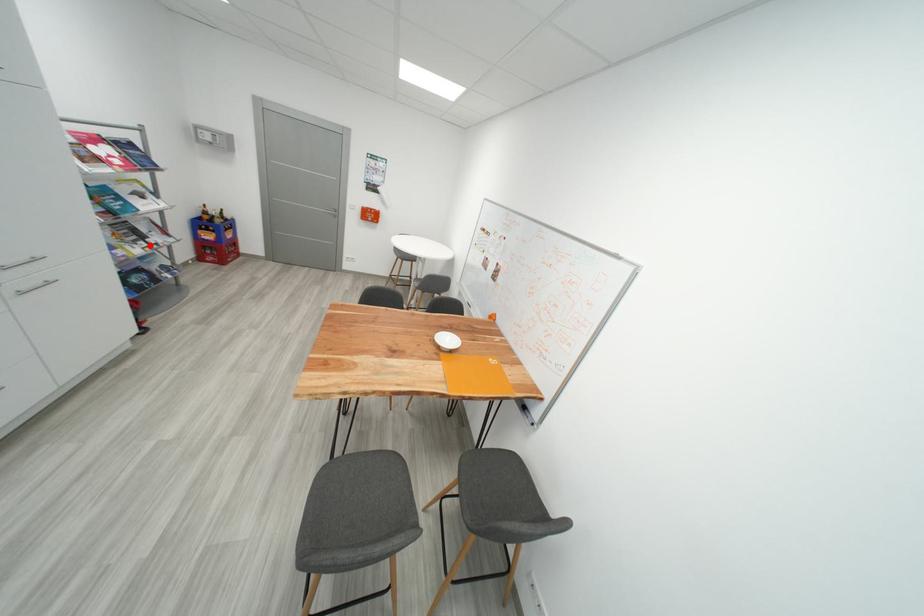
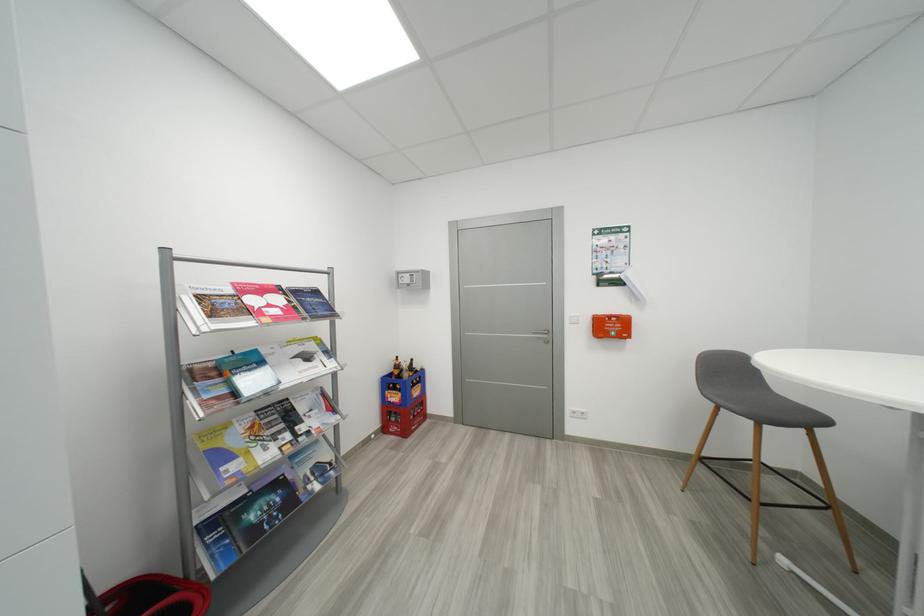
In the second image, find the point that corresponds to the highlighted location in the first image.

(294, 438)